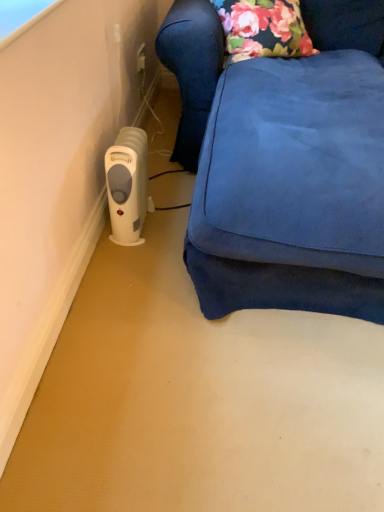
You are a GUI agent. You are given a task and a screenshot of the screen. Output one action in this format:
    pyautogui.click(x=<x>, y=<y>)
    Task: Click on the unoccupied region to the right of white plastic heater at lower left
    This screenshot has width=384, height=512.
    Given the screenshot: What is the action you would take?
    pyautogui.click(x=171, y=231)